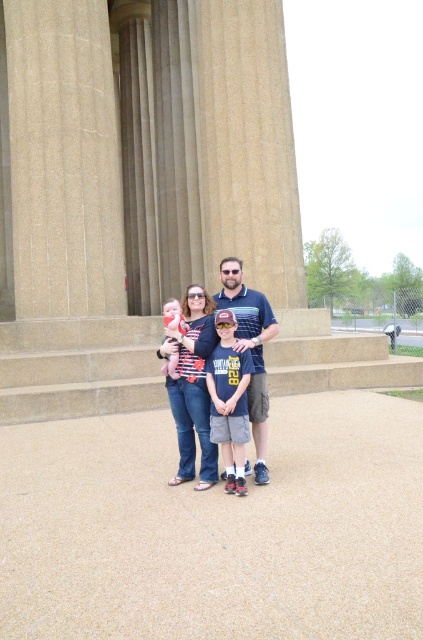
Which is more to the left, denim shorts at center or blue striped polo shirt at center?

From the viewer's perspective, denim shorts at center appears more on the left side.

In the scene shown: Who is more distant from viewer, [225,388] or [255,307]?

The point [255,307] is more distant.

The height and width of the screenshot is (640, 423). In order to click on denim shorts at center in this screenshot , I will do `click(228, 401)`.

Who is taller, denim shorts at center or matte pink baby at center?

denim shorts at center is taller.

Measure the distance between denim shorts at center and matte pink baby at center.

denim shorts at center and matte pink baby at center are 28.61 inches apart from each other.

Does point (238, 368) come behind point (169, 364)?

No, it is not.

This screenshot has width=423, height=640. In order to click on denim shorts at center in this screenshot , I will do `click(228, 401)`.

Does matte black shirt at center have a larger size compared to blue striped polo shirt at center?

Actually, matte black shirt at center might be smaller than blue striped polo shirt at center.

Does matte black shirt at center have a greater width compared to blue striped polo shirt at center?

Incorrect, matte black shirt at center's width does not surpass blue striped polo shirt at center's.

The height and width of the screenshot is (640, 423). Describe the element at coordinates (192, 387) in the screenshot. I see `matte black shirt at center` at that location.

The image size is (423, 640). I want to click on matte black shirt at center, so click(192, 387).